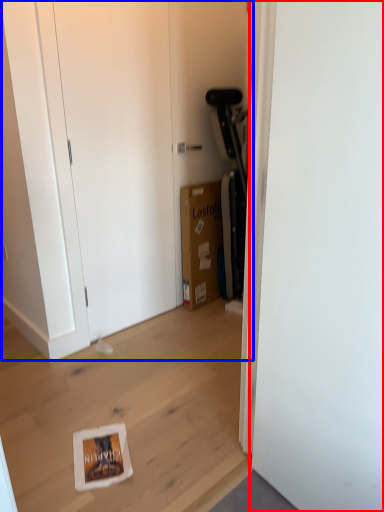
Question: Which of the following is the closest to the observer, door (highlighted by a red box) or dresser (highlighted by a blue box)?

Choices:
 (A) door
 (B) dresser

Answer: (A)